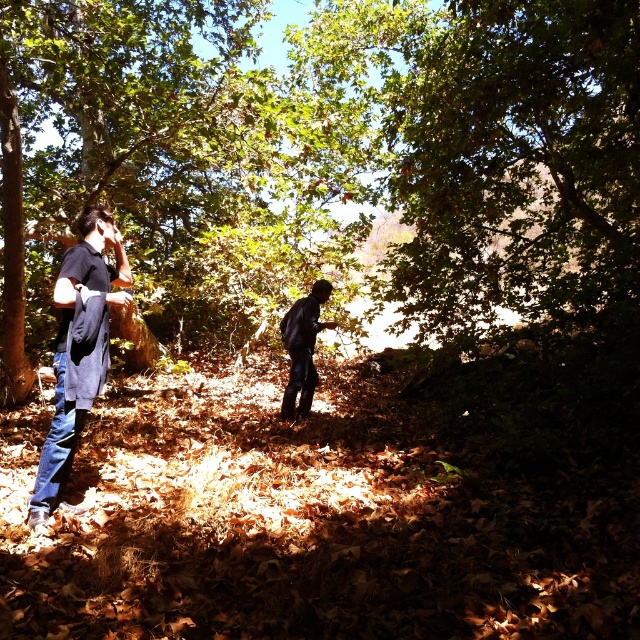
You are a hiker trying to decide which item to grab first from the forest floor. You see a denim jacket at left and dark blue jeans at center. Which item is taller?

The denim jacket at left is taller than the dark blue jeans at center, so you should grab the denim jacket at left first since it is taller.

You are a hiker who has just arrived at a forest trail. You see the denim jacket at left lying on the ground. If you want to pick it up, where exactly should you look?

The denim jacket at left is located at point (77, 348), so you should look there to pick it up.